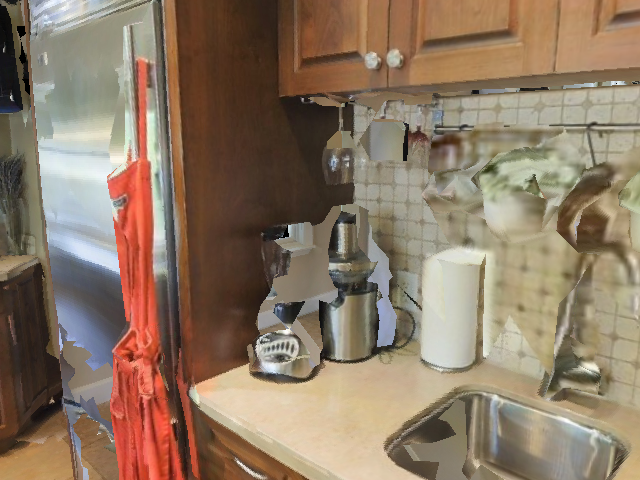
Find the location of `floor`. floor is located at coordinates (38, 467).